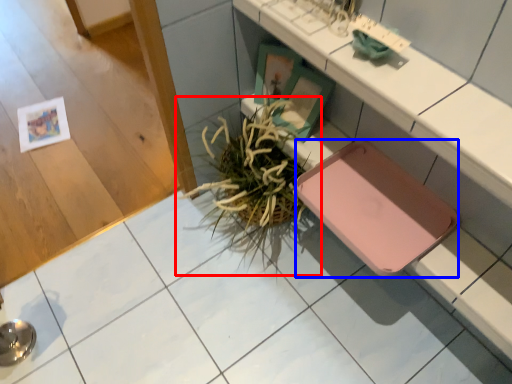
Question: Which object is closer to the camera taking this photo, houseplant (highlighted by a red box) or pad (highlighted by a blue box)?

Choices:
 (A) houseplant
 (B) pad

Answer: (B)